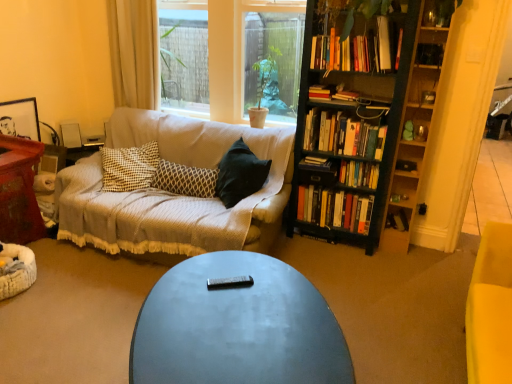
The image size is (512, 384). I want to click on vacant area to the left of matte black coffee table at center, so click(x=82, y=330).